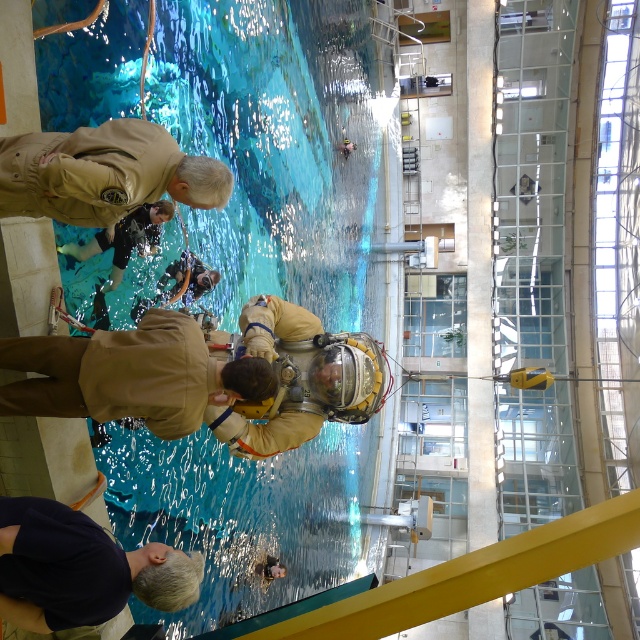
You are standing at point (353, 253) and want to reach the astronaut in the pool. The pool is 50 meters long. Is the astronaut within the pool?

The astronaut is 46.75 meters away from point (353, 253). Since the pool is 50 meters long, the astronaut is within the pool.

You are a photographer positioned at the camera location. You want to capture a photo where both the point at (307, 220) and the point at (278, 573) are in focus. Which point should you focus on to ensure both are sharp?

You should focus on the point at (307, 220) because it is further away from the camera than the point at (278, 573). By focusing on the further point, the closer point will also be within the depth of field, ensuring both are in focus.